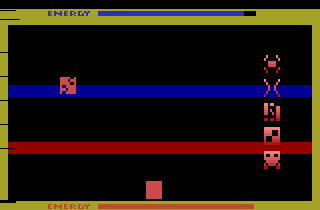
Locate an element on the screen. Image resolution: width=320 pixels, height=210 pixels. play area is located at coordinates (161, 120).